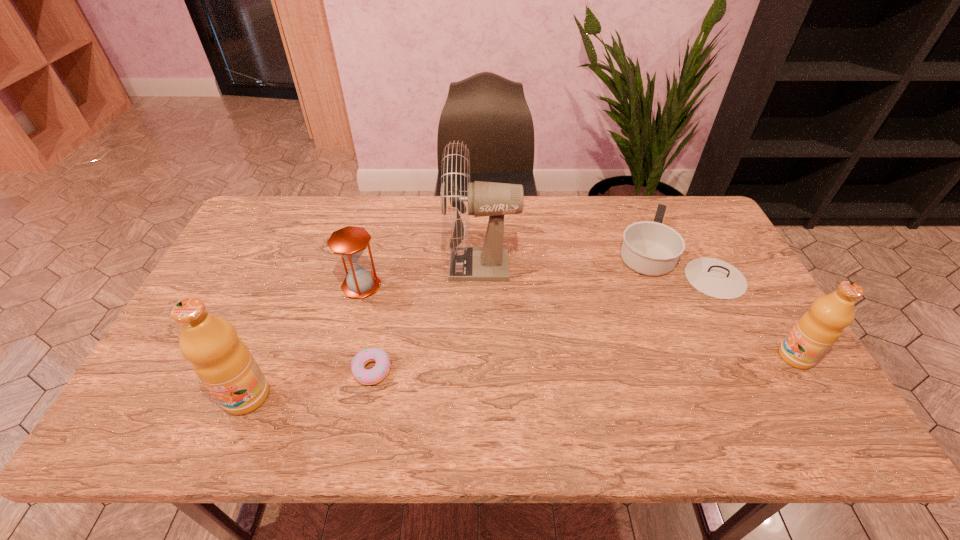
To make them evenly spaced by inserting another fruit_juice among them, please locate a free space for this new fruit_juice. Please provide its 2D coordinates. Your answer should be formatted as a tuple, i.e. [(x, y)], where the tuple contains the x and y coordinates of a point satisfying the conditions above.

[(531, 375)]